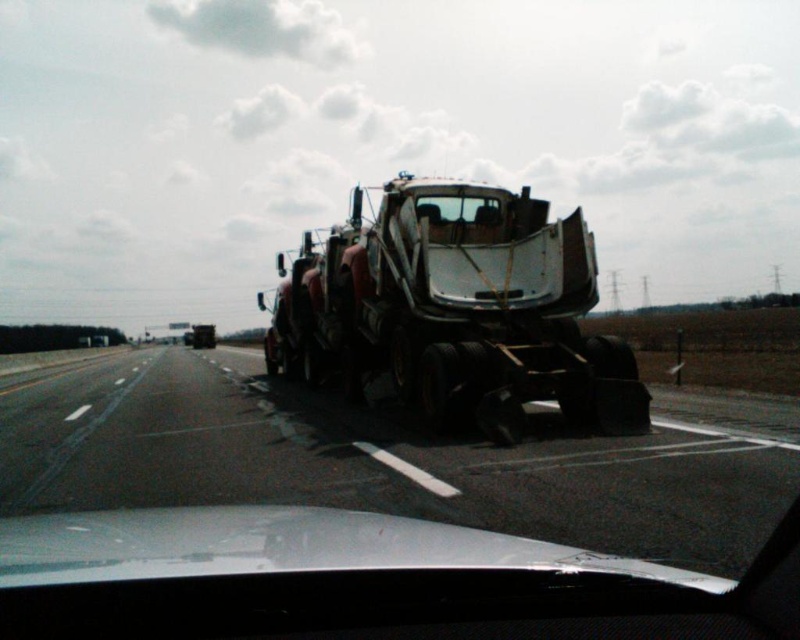
Who is more forward, (173, 436) or (486, 208)?

Point (173, 436) is in front.

Can you confirm if black asphalt highway at center is positioned to the left of clear glass windshield at center?

Yes, black asphalt highway at center is to the left of clear glass windshield at center.

Measure the distance between point (x=364, y=440) and camera.

Point (x=364, y=440) is 29.64 feet away from camera.

Image resolution: width=800 pixels, height=640 pixels. I want to click on black asphalt highway at center, so click(x=376, y=461).

Can you confirm if rusty metal tow truck at center is smaller than clear glass windshield at center?

Incorrect, rusty metal tow truck at center is not smaller in size than clear glass windshield at center.

Can you confirm if rusty metal tow truck at center is positioned above clear glass windshield at center?

Yes.

Is point (470, 193) farther from camera compared to point (501, 212)?

No.

Identify the location of rusty metal tow truck at center. The image size is (800, 640). (456, 316).

Between black asphalt highway at center and rusty metal tow truck at center, which one is positioned higher?

rusty metal tow truck at center

Does black asphalt highway at center appear over rusty metal tow truck at center?

Actually, black asphalt highway at center is below rusty metal tow truck at center.

Which is behind, point (256, 417) or point (509, 353)?

The point (256, 417) is behind.

The height and width of the screenshot is (640, 800). Find the location of `black asphalt highway at center`. black asphalt highway at center is located at coordinates (376, 461).